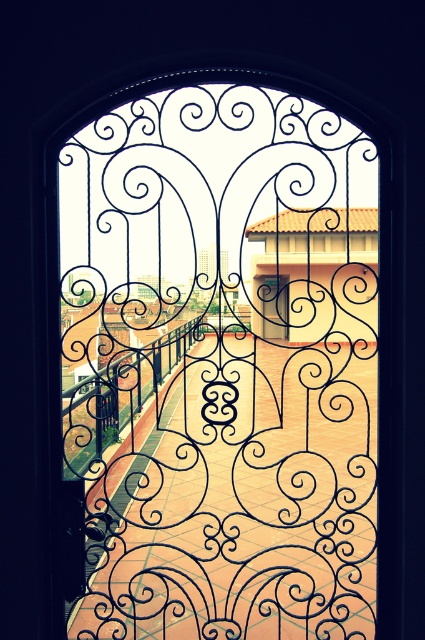
Does point (351, 637) come in front of point (265, 321)?

Yes, it is in front of point (265, 321).

Locate an element on the screen. This screenshot has width=425, height=640. black wrought iron gate at center is located at coordinates (221, 365).

Which is behind, point (107, 150) or point (268, 291)?

The point (268, 291) is behind.

Find the location of a particular element. The height and width of the screenshot is (640, 425). black wrought iron gate at center is located at coordinates (221, 365).